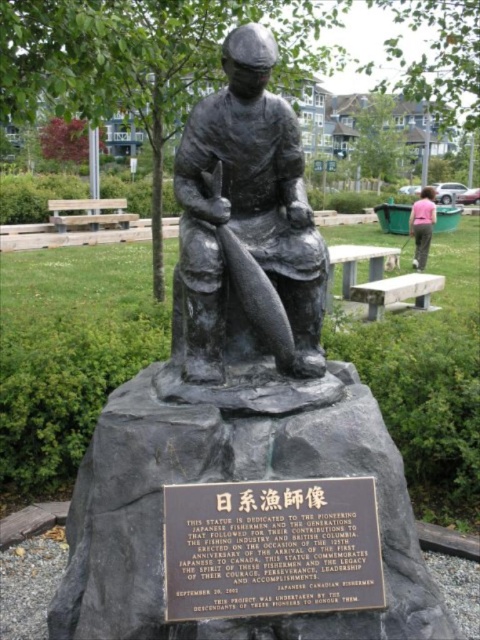
Is point (257, 346) positioned behind point (230, 536)?

Yes, it is behind point (230, 536).

At what (x,y) coordinates should I click in order to perform the action: click on bronze statue of fisherman at center. Please return your answer as a coordinate pair (x, y). Looking at the image, I should click on (244, 220).

Which is in front, point (235, 145) or point (427, 212)?

Point (235, 145)

Which is in front, point (266, 52) or point (427, 250)?

Point (266, 52) is more forward.

Locate an element on the screen. The width and height of the screenshot is (480, 640). bronze statue of fisherman at center is located at coordinates (244, 220).

This screenshot has height=640, width=480. Describe the element at coordinates (271, 547) in the screenshot. I see `bronze plaque at center` at that location.

Who is taller, bronze plaque at center or pink fabric pants at lower right?

Standing taller between the two is pink fabric pants at lower right.

I want to click on bronze plaque at center, so click(271, 547).